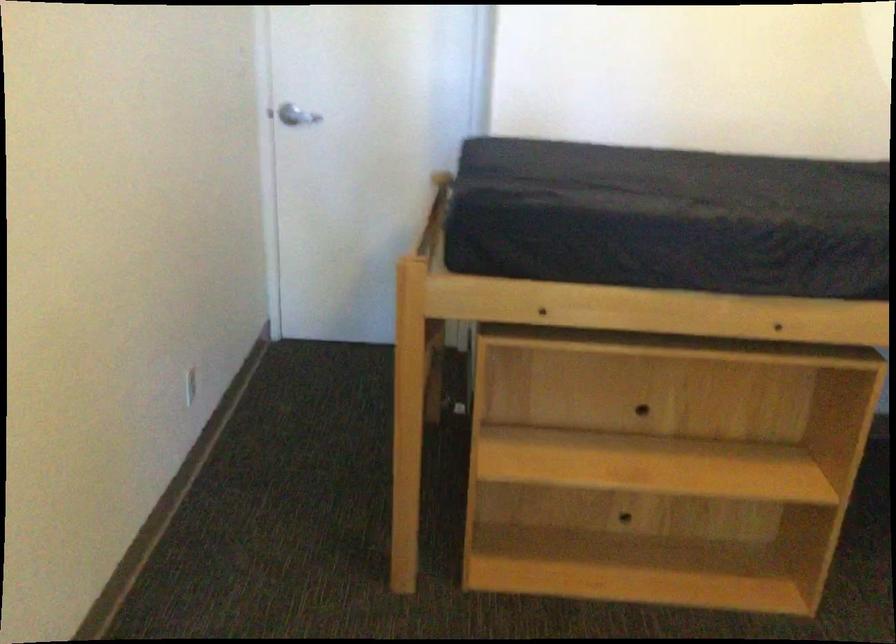
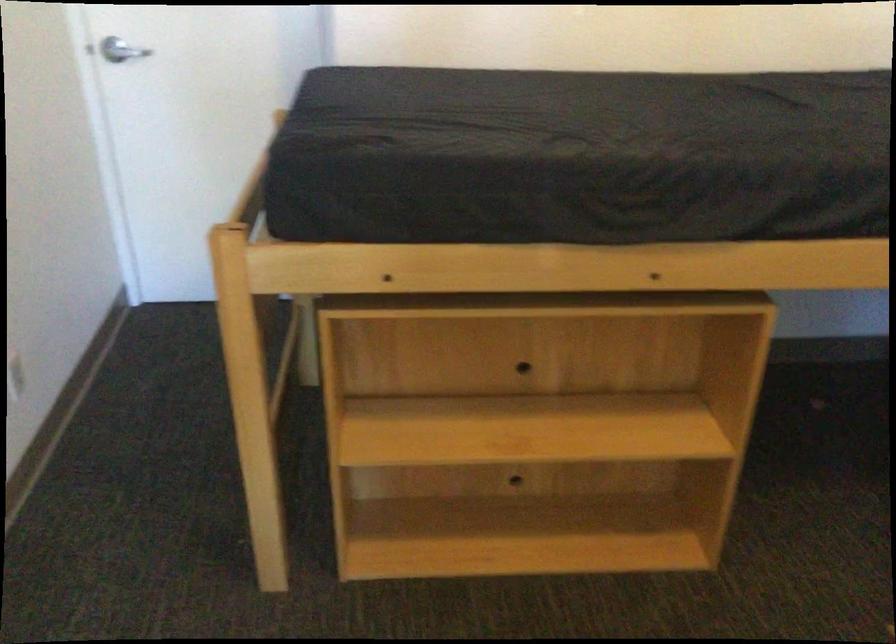
Which direction would the cameraman need to move to produce the second image?

The cameraman moved toward right, forward.